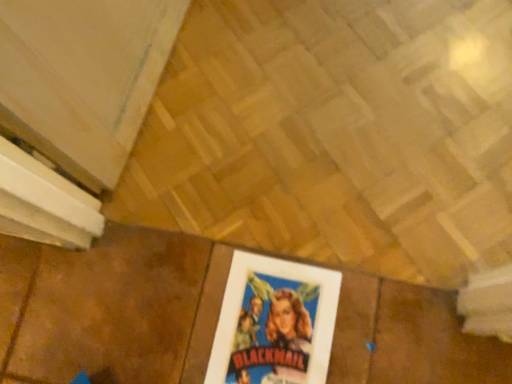
Identify the location of free location above white matte picture frame at lower center (from a real-world perspective). 267,327.